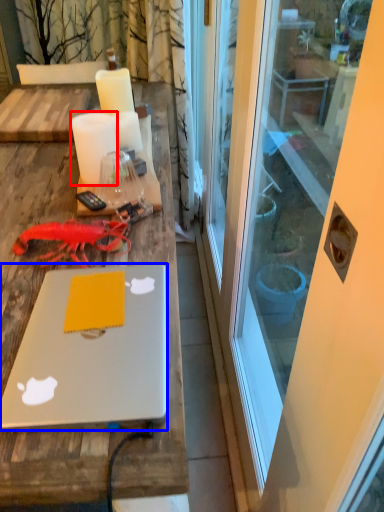
Question: Which object is closer to the camera taking this photo, candle (highlighted by a red box) or laptop (highlighted by a blue box)?

Choices:
 (A) candle
 (B) laptop

Answer: (B)